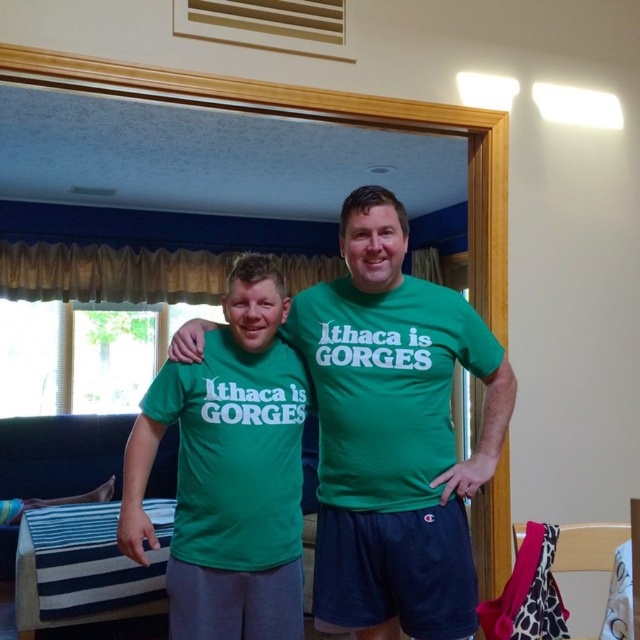
Question: Which point is closer to the camera?

Choices:
 (A) (353, 410)
 (B) (291, 426)

Answer: (A)

Question: Does green matte t-shirt at center come behind matte green t-shirt at center?

Choices:
 (A) no
 (B) yes

Answer: (A)

Question: Is green matte t-shirt at center positioned at the back of matte green t-shirt at center?

Choices:
 (A) no
 (B) yes

Answer: (A)

Question: Is green matte t-shirt at center in front of matte green t-shirt at center?

Choices:
 (A) no
 (B) yes

Answer: (B)